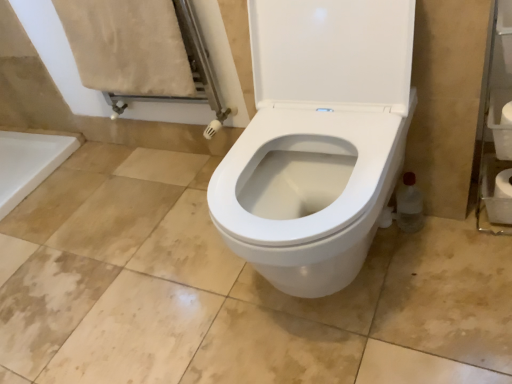
Question: From their relative heights in the image, would you say white matte toilet paper at right, the 2th toilet paper positioned from the top, is taller or shorter than white matte toilet paper at right, the first toilet paper when ordered from front to back?

Choices:
 (A) tall
 (B) short

Answer: (A)

Question: In the image, is white matte toilet paper at right, which ranks as the first toilet paper in bottom-to-top order, positioned in front of or behind white matte toilet paper at right, the 1th toilet paper in the top-to-bottom sequence?

Choices:
 (A) front
 (B) behind

Answer: (B)

Question: From the image's perspective, relative to white matte toilet paper at right, the first toilet paper when ordered from front to back, is white matte toilet paper at right, which ranks as the first toilet paper in bottom-to-top order, above or below?

Choices:
 (A) below
 (B) above

Answer: (A)

Question: Visually, is white matte toilet paper at right, acting as the second toilet paper starting from the bottom, positioned to the left or to the right of white matte toilet paper at right, which ranks as the 2th toilet paper in front-to-back order?

Choices:
 (A) left
 (B) right

Answer: (A)

Question: From a real-world perspective, is white matte toilet paper at right, acting as the second toilet paper starting from the bottom, physically located above or below white matte toilet paper at right, which ranks as the 2th toilet paper in front-to-back order?

Choices:
 (A) above
 (B) below

Answer: (A)

Question: In terms of height, does white matte toilet paper at right, acting as the second toilet paper starting from the bottom, look taller or shorter compared to white matte toilet paper at right, which is the 1th toilet paper in back-to-front order?

Choices:
 (A) short
 (B) tall

Answer: (A)

Question: Is white matte toilet paper at right, the first toilet paper when ordered from front to back, spatially inside white matte toilet paper at right, the 2th toilet paper positioned from the top, or outside of it?

Choices:
 (A) inside
 (B) outside

Answer: (B)